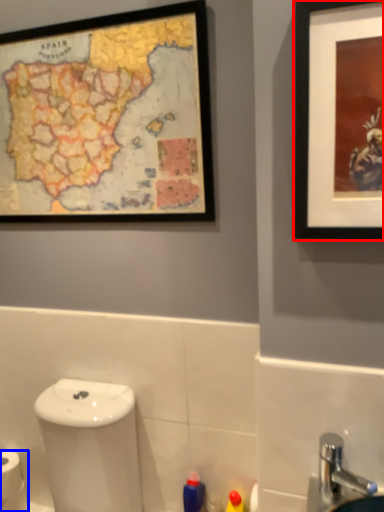
Question: Which point is further to the camera, picture frame (highlighted by a red box) or toilet paper (highlighted by a blue box)?

Choices:
 (A) picture frame
 (B) toilet paper

Answer: (B)